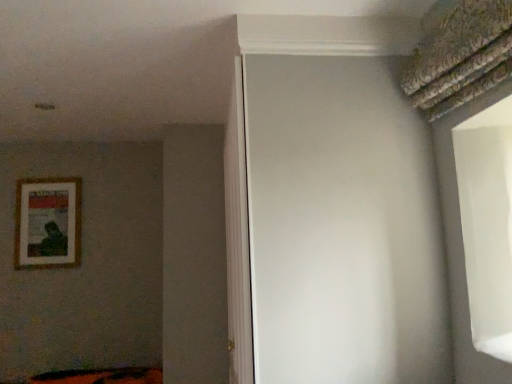
This screenshot has height=384, width=512. What do you see at coordinates (342, 225) in the screenshot?
I see `white matte screen door at center` at bounding box center [342, 225].

At what (x,y) coordinates should I click in order to perform the action: click on white matte screen door at center. Please return your answer as a coordinate pair (x, y). This screenshot has height=384, width=512. Looking at the image, I should click on (342, 225).

Looking at this image, measure the distance between white matte screen door at center and camera.

The distance of white matte screen door at center from camera is 1.25 meters.

Measure the distance between point (325,280) and camera.

Point (325,280) is 4.30 feet away from camera.

What are the coordinates of `wooden framed poster at left` in the screenshot? It's located at (48, 223).

This screenshot has height=384, width=512. What do you see at coordinates (48, 223) in the screenshot?
I see `wooden framed poster at left` at bounding box center [48, 223].

You are a GUI agent. You are given a task and a screenshot of the screen. Output one action in this format:
    pyautogui.click(x=<x>, y=<y>)
    Task: Click on the white matte screen door at center
    The height and width of the screenshot is (384, 512).
    Given the screenshot: What is the action you would take?
    pyautogui.click(x=342, y=225)

Is white matte screen door at center to the right of wooden framed poster at left from the viewer's perspective?

Correct, you'll find white matte screen door at center to the right of wooden framed poster at left.

Relative to wooden framed poster at left, is white matte screen door at center in front or behind?

Clearly, white matte screen door at center is in front of wooden framed poster at left.

Is point (342, 158) farther from viewer compared to point (17, 195)?

No, it is in front of (17, 195).

From the image's perspective, which is above, white matte screen door at center or wooden framed poster at left?

wooden framed poster at left is shown above in the image.

From a real-world perspective, is white matte screen door at center under wooden framed poster at left?

Indeed, from a real-world perspective, white matte screen door at center is positioned beneath wooden framed poster at left.

Consider the image. Between white matte screen door at center and wooden framed poster at left, which one has larger width?

With larger width is white matte screen door at center.

Considering the relative sizes of white matte screen door at center and wooden framed poster at left in the image provided, is white matte screen door at center shorter than wooden framed poster at left?

No, white matte screen door at center is not shorter than wooden framed poster at left.

Can you confirm if white matte screen door at center is smaller than wooden framed poster at left?

Incorrect, white matte screen door at center is not smaller in size than wooden framed poster at left.

Is white matte screen door at center completely or partially outside of wooden framed poster at left?

Yes, white matte screen door at center is outside of wooden framed poster at left.

Is the surface of white matte screen door at center in direct contact with wooden framed poster at left?

No.

Does white matte screen door at center turn towards wooden framed poster at left?

Yes, white matte screen door at center is oriented towards wooden framed poster at left.

How many degrees apart are the facing directions of white matte screen door at center and wooden framed poster at left?

The facing directions of white matte screen door at center and wooden framed poster at left are 90.1 degrees apart.

At what (x,y) coordinates should I click in order to perform the action: click on picture frame that appears above the white matte screen door at center (from the image's perspective). Please return your answer as a coordinate pair (x, y). This screenshot has width=512, height=384. Looking at the image, I should click on (48, 223).

Considering the relative positions of wooden framed poster at left and white matte screen door at center in the image provided, is wooden framed poster at left to the left of white matte screen door at center from the viewer's perspective?

Yes, wooden framed poster at left is to the left of white matte screen door at center.

Is wooden framed poster at left closer to camera compared to white matte screen door at center?

No, wooden framed poster at left is further to the viewer.

Considering the positions of point (70, 183) and point (292, 167), is point (70, 183) closer or farther from the camera than point (292, 167)?

Clearly, point (70, 183) is more distant from the camera than point (292, 167).

From the image's perspective, is wooden framed poster at left below white matte screen door at center?

Actually, wooden framed poster at left appears above white matte screen door at center in the image.

From a real-world perspective, is wooden framed poster at left under white matte screen door at center?

No.

Is wooden framed poster at left wider than white matte screen door at center?

Incorrect, the width of wooden framed poster at left does not surpass that of white matte screen door at center.

Based on the photo, can you confirm if wooden framed poster at left is taller than white matte screen door at center?

No.

Can you confirm if wooden framed poster at left is smaller than white matte screen door at center?

Indeed, wooden framed poster at left has a smaller size compared to white matte screen door at center.

Would you say wooden framed poster at left is inside or outside white matte screen door at center?

The correct answer is: outside.

Can you see wooden framed poster at left touching white matte screen door at center?

They are not placed beside each other.

Is wooden framed poster at left positioned with its back to white matte screen door at center?

No, wooden framed poster at left's orientation is not away from white matte screen door at center.

How many degrees apart are the facing directions of wooden framed poster at left and white matte screen door at center?

wooden framed poster at left and white matte screen door at center are facing 90.1 degrees away from each other.

At what (x,y) coordinates should I click in order to perform the action: click on picture frame lying on the left of white matte screen door at center. Please return your answer as a coordinate pair (x, y). The image size is (512, 384). Looking at the image, I should click on (48, 223).

Image resolution: width=512 pixels, height=384 pixels. Identify the location of picture frame above the white matte screen door at center (from a real-world perspective). (48, 223).

Find the location of a particular element. picture frame above the white matte screen door at center (from the image's perspective) is located at coordinates (48, 223).